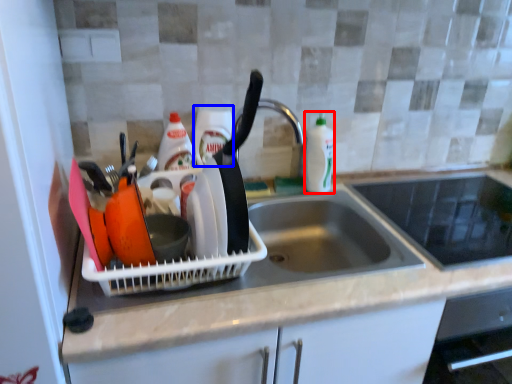
Question: Which of the following is the closest to the observer, bottle (highlighted by a red box) or bottle (highlighted by a blue box)?

Choices:
 (A) bottle
 (B) bottle

Answer: (B)